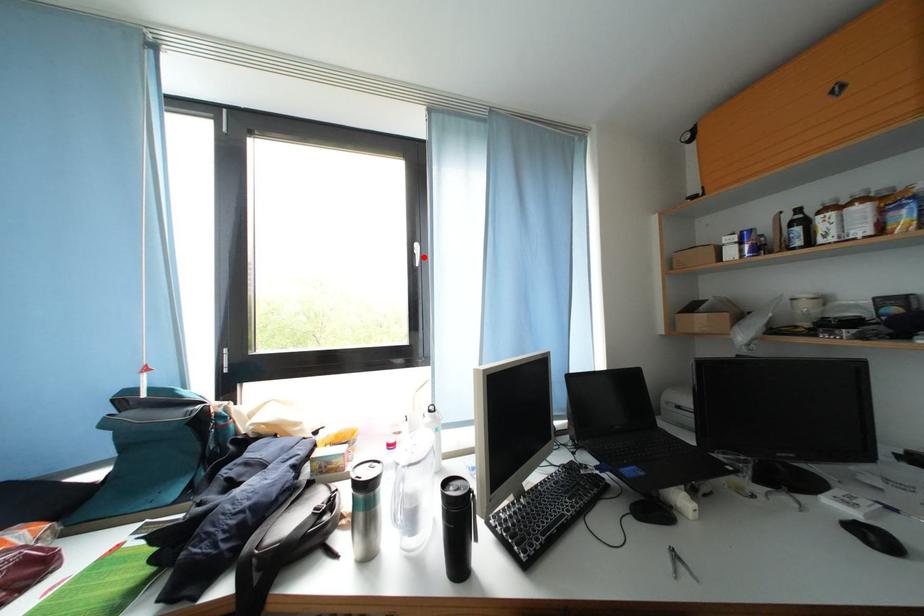
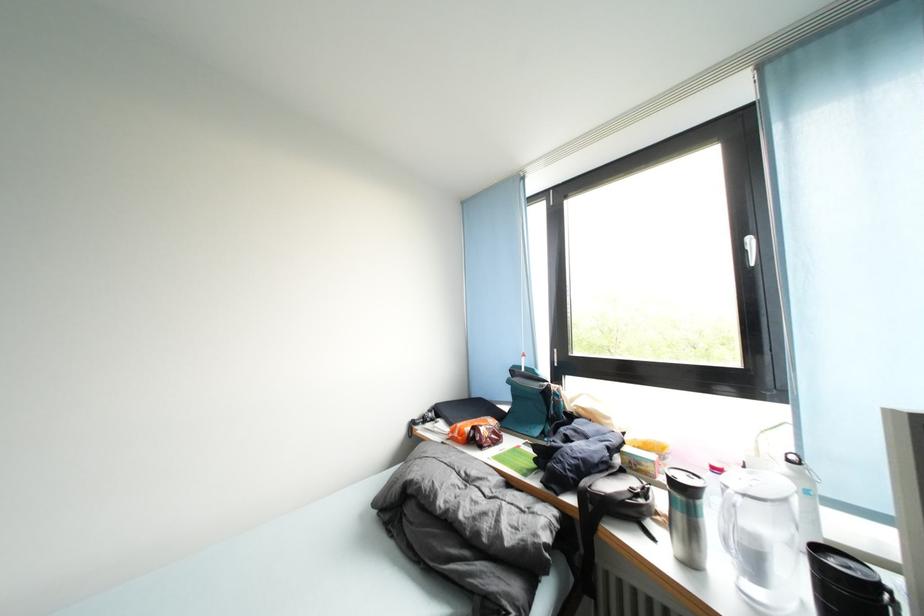
Locate, in the second image, the point that corresponds to the highlighted location in the first image.

(757, 253)